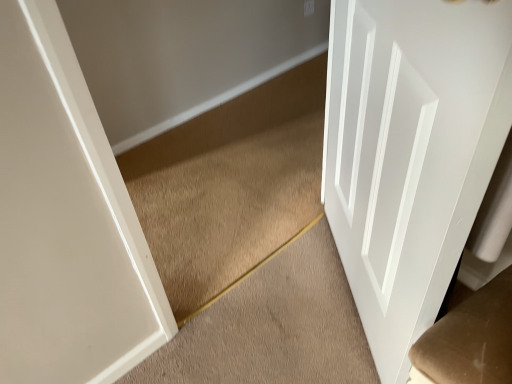
Measure the distance between white glossy door at right and camera.

17.57 inches.

Identify the location of white glossy door at right. This screenshot has height=384, width=512. [x=410, y=152].

The image size is (512, 384). What do you see at coordinates (410, 152) in the screenshot?
I see `white glossy door at right` at bounding box center [410, 152].

Measure the distance between carpet at center and camera.

carpet at center is 3.73 feet from camera.

Describe the element at coordinates (272, 326) in the screenshot. This screenshot has height=384, width=512. I see `carpet at center` at that location.

The width and height of the screenshot is (512, 384). I want to click on carpet at center, so click(x=272, y=326).

This screenshot has width=512, height=384. I want to click on white glossy door at right, so click(410, 152).

Based on the photo, does carpet at center appear on the left side of white glossy door at right?

Yes.

Considering the positions of objects carpet at center and white glossy door at right in the image provided, who is behind, carpet at center or white glossy door at right?

carpet at center is further from the camera.

Is point (311, 298) farther from viewer compared to point (338, 246)?

No, it is in front of (338, 246).

Based on the photo, from the image's perspective, relative to white glossy door at right, is carpet at center above or below?

Clearly, from the image's perspective, carpet at center is below white glossy door at right.

From a real-world perspective, is carpet at center on top of white glossy door at right?

No, from a real-world perspective, carpet at center is not over white glossy door at right

Considering the relative sizes of carpet at center and white glossy door at right in the image provided, is carpet at center thinner than white glossy door at right?

In fact, carpet at center might be wider than white glossy door at right.

In terms of height, does carpet at center look taller or shorter compared to white glossy door at right?

In the image, carpet at center appears to be shorter than white glossy door at right.

Is carpet at center bigger than white glossy door at right?

No.

Is white glossy door at right inside carpet at center?

No.

Is carpet at center not close to white glossy door at right?

No, carpet at center is not far away from white glossy door at right.

Is white glossy door at right at the back of carpet at center?

No, carpet at center's orientation is not away from white glossy door at right.

How many degrees apart are the facing directions of carpet at center and white glossy door at right?

The angular difference between carpet at center and white glossy door at right is 145 degrees.

Locate an element on the screen. This screenshot has width=512, height=384. stairwell that appears below the white glossy door at right (from a real-world perspective) is located at coordinates pos(272,326).

Considering the relative positions of white glossy door at right and carpet at center in the image provided, is white glossy door at right to the right of carpet at center from the viewer's perspective?

Correct, you'll find white glossy door at right to the right of carpet at center.

Is white glossy door at right positioned in front of carpet at center?

Yes, it is in front of carpet at center.

Is point (361, 251) positioned before point (306, 300)?

That is True.

From the image's perspective, relative to carpet at center, is white glossy door at right above or below?

white glossy door at right is situated higher than carpet at center in the image.

Consider the image. From a real-world perspective, who is located lower, white glossy door at right or carpet at center?

carpet at center.

Considering the relative sizes of white glossy door at right and carpet at center in the image provided, is white glossy door at right thinner than carpet at center?

Indeed, white glossy door at right has a lesser width compared to carpet at center.

Which of these two, white glossy door at right or carpet at center, stands shorter?

Standing shorter between the two is carpet at center.

Based on their sizes in the image, would you say white glossy door at right is bigger or smaller than carpet at center?

white glossy door at right is bigger than carpet at center.

Consider the image. Do you think white glossy door at right is within carpet at center, or outside of it?

white glossy door at right is located beyond the bounds of carpet at center.

Is white glossy door at right far away from carpet at center?

They are positioned close to each other.

Is white glossy door at right oriented towards carpet at center?

Yes, white glossy door at right is turned towards carpet at center.

Measure the distance between white glossy door at right and carpet at center.

white glossy door at right and carpet at center are 15.93 inches apart.

Identify the location of stairwell that appears on the left of white glossy door at right. This screenshot has height=384, width=512. (272, 326).

Find the location of a particular element. The width and height of the screenshot is (512, 384). door above the carpet at center (from the image's perspective) is located at coordinates (410, 152).

The image size is (512, 384). Identify the location of door on the right of carpet at center. (410, 152).